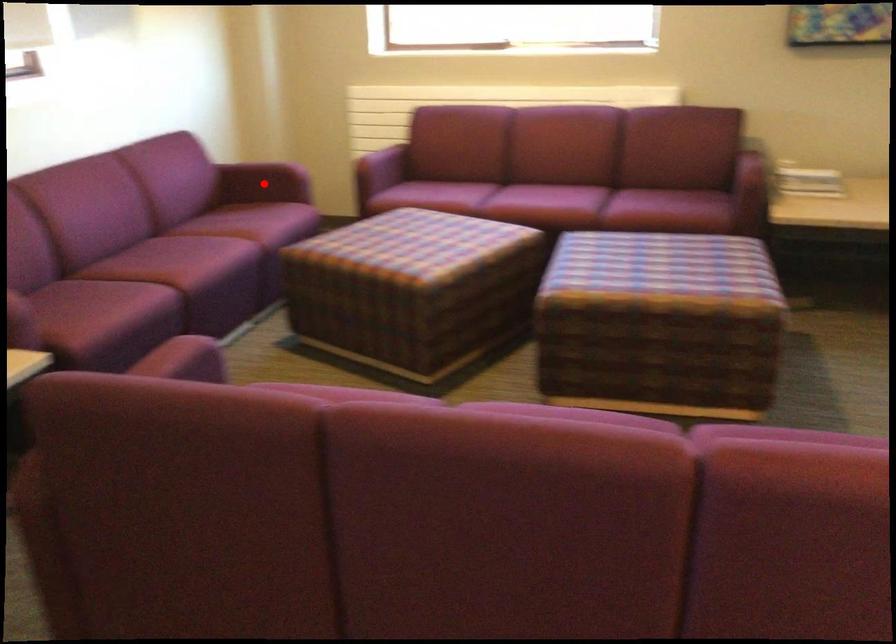
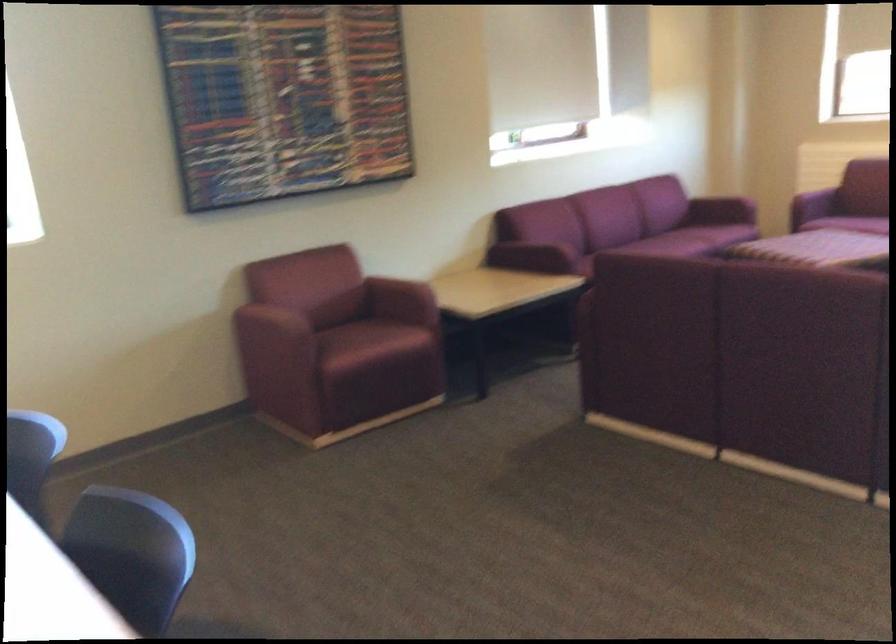
Question: A red point is marked in image1. In image2, is the corresponding 3D point closer to the camera or farther? Reply with the corresponding letter.

Choices:
 (A) The corresponding 3D point is closer.
 (B) The corresponding 3D point is farther.

Answer: (B)